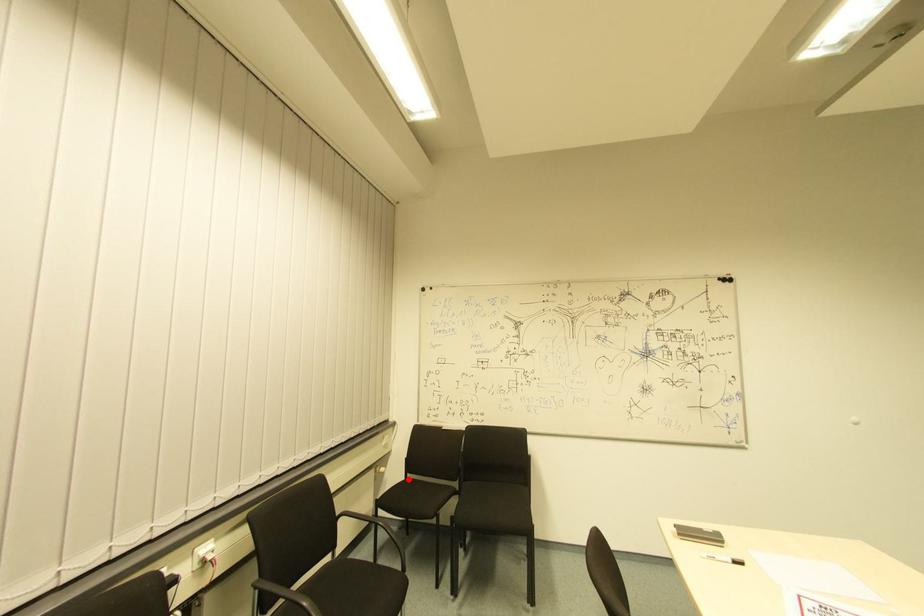
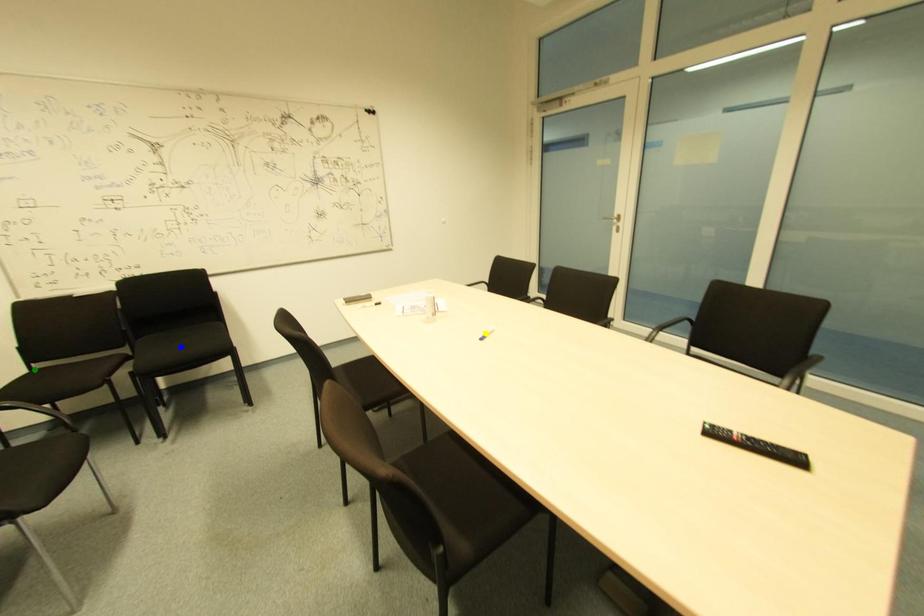
Question: I am providing you with two images of the same scene from different viewpoints. A red point is marked on the first image. You are given multiple points on the second image. Which point in image 2 represents the same 3d spot as the red point in image 1?

Choices:
 (A) green point
 (B) blue point
 (C) yellow point

Answer: (A)